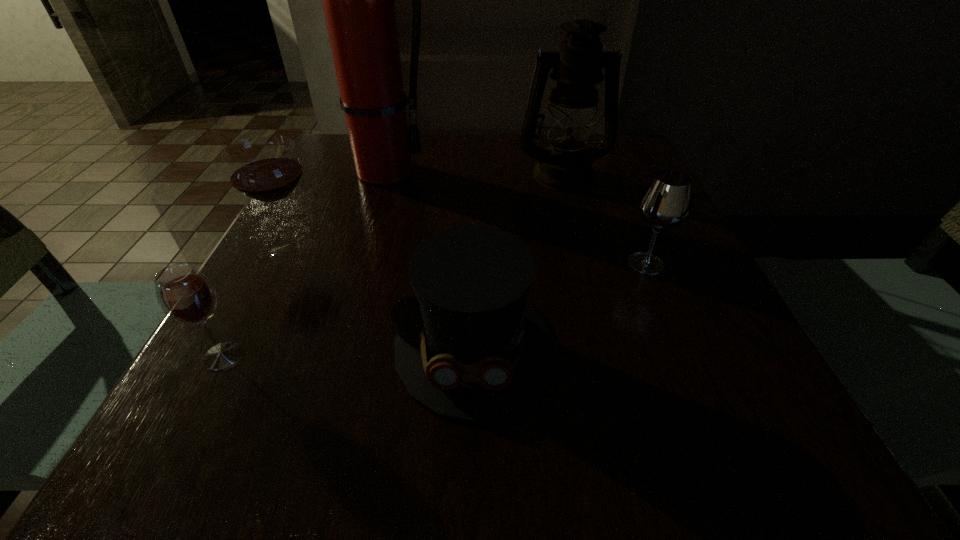
Where is `fire extinguisher that is at the far edge`? This screenshot has width=960, height=540. fire extinguisher that is at the far edge is located at coordinates (358, 0).

Identify the location of oil lamp present at the far edge. Image resolution: width=960 pixels, height=540 pixels. (577, 66).

In order to click on object that is at the near edge in this screenshot , I will do point(472,348).

Image resolution: width=960 pixels, height=540 pixels. What are the coordinates of `fire extinguisher that is positioned at the left edge` in the screenshot? It's located at (358, 0).

Identify the location of oil lamp that is at the right edge. This screenshot has height=540, width=960. (577, 66).

Image resolution: width=960 pixels, height=540 pixels. What are the coordinates of `wineglass present at the right edge` in the screenshot? It's located at (666, 202).

Find the location of `object that is positioned at the far left corner`. object that is positioned at the far left corner is located at coordinates (358, 0).

This screenshot has height=540, width=960. Identify the location of object present at the far right corner. (x=577, y=66).

In the image, there is a desktop. Where is `vacant space at the far edge`? The height and width of the screenshot is (540, 960). vacant space at the far edge is located at coordinates (487, 164).

The width and height of the screenshot is (960, 540). I want to click on blank space at the near edge of the desktop, so click(470, 480).